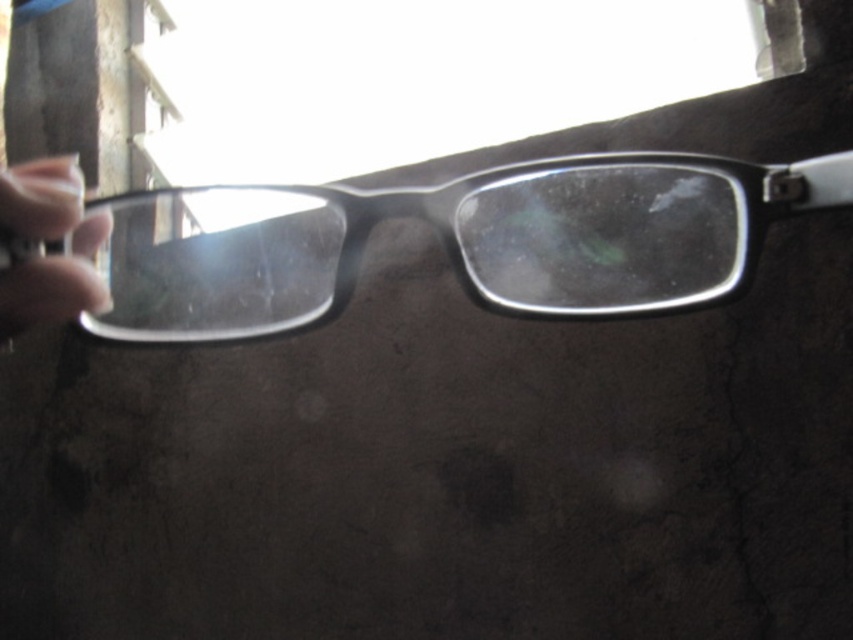
Question: Does transparent plastic glasses at upper center have a smaller size compared to flesh-toned skin at left?

Choices:
 (A) no
 (B) yes

Answer: (A)

Question: Can you confirm if transparent plastic glasses at upper center is positioned above flesh-toned skin at left?

Choices:
 (A) no
 (B) yes

Answer: (B)

Question: Which of the following is the closest to the observer?

Choices:
 (A) (93, 225)
 (B) (506, 214)

Answer: (A)

Question: Is transparent plastic glasses at upper center wider than flesh-toned skin at left?

Choices:
 (A) yes
 (B) no

Answer: (A)

Question: Among these points, which one is nearest to the camera?

Choices:
 (A) (54, 211)
 (B) (242, 320)

Answer: (A)

Question: Which point is farther to the camera?

Choices:
 (A) (45, 172)
 (B) (294, 275)

Answer: (B)